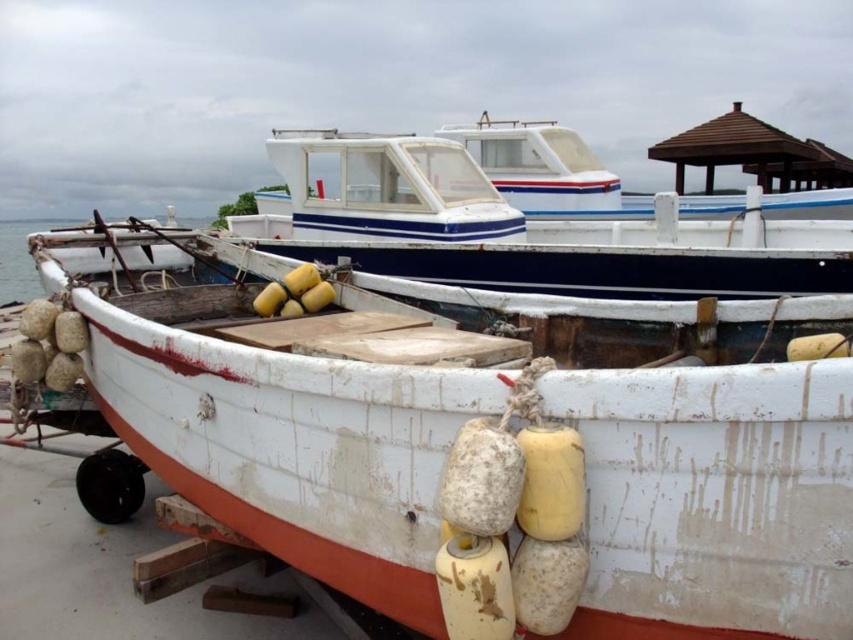
You are standing on the dock and see the white matte boat at center and the transparent water at boat front. Which object is positioned to the left?

The transparent water at boat front is positioned to the left of the white matte boat at center.

You are standing on the dock and want to board the white matte boat at center. Which direction should you move relative to the white weathered wood boat at lower left?

You should move to the right relative to the white weathered wood boat at lower left to reach the white matte boat at center since the white weathered wood boat at lower left is to the left of the white matte boat at center.